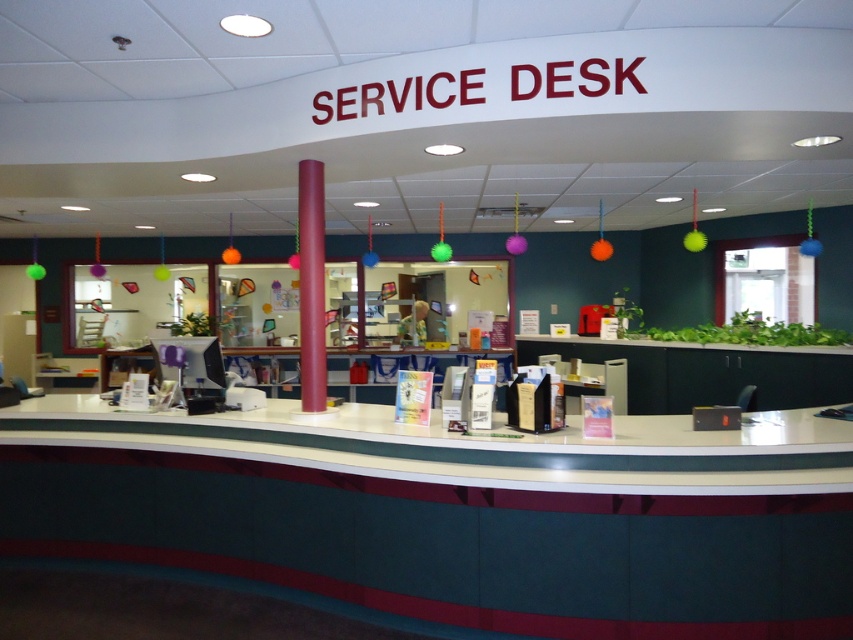
Question: From the image, what is the correct spatial relationship of green laminate desk at center in relation to matte plastic information desk at center?

Choices:
 (A) above
 (B) below

Answer: (A)

Question: Does green laminate desk at center come in front of matte plastic information desk at center?

Choices:
 (A) yes
 (B) no

Answer: (A)

Question: Among these objects, which one is farthest from the camera?

Choices:
 (A) matte plastic information desk at center
 (B) green laminate desk at center

Answer: (A)

Question: Which point is closer to the camera?

Choices:
 (A) green laminate desk at center
 (B) matte plastic information desk at center

Answer: (A)

Question: Does green laminate desk at center have a smaller size compared to matte plastic information desk at center?

Choices:
 (A) yes
 (B) no

Answer: (B)

Question: Which object is closer to the camera taking this photo?

Choices:
 (A) matte plastic information desk at center
 (B) green laminate desk at center

Answer: (B)